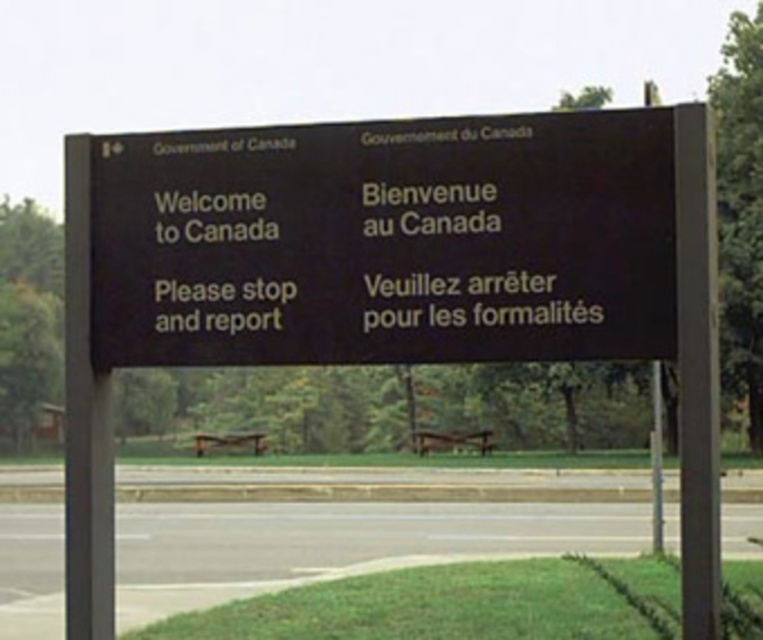
Who is shorter, black matte signboard at center or black matte sign at center?

With less height is black matte sign at center.

Describe the element at coordinates (390, 275) in the screenshot. I see `black matte signboard at center` at that location.

Who is more forward, (304, 268) or (377, 264)?

Positioned in front is point (377, 264).

I want to click on black matte signboard at center, so click(x=390, y=275).